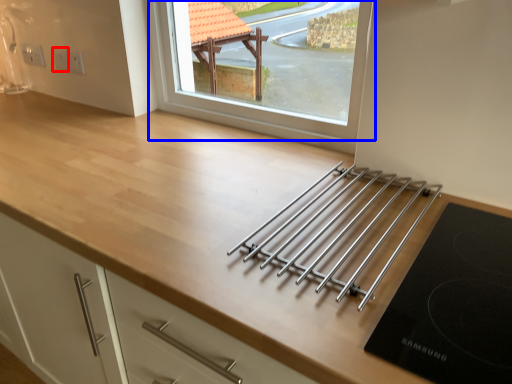
Question: Among these objects, which one is farthest to the camera, electric outlet (highlighted by a red box) or window (highlighted by a blue box)?

Choices:
 (A) electric outlet
 (B) window

Answer: (A)